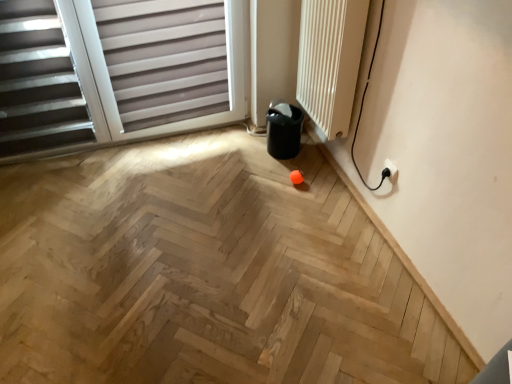
Locate an element on the screen. The height and width of the screenshot is (384, 512). spots to the right of matte gray blinds at upper left is located at coordinates (221, 173).